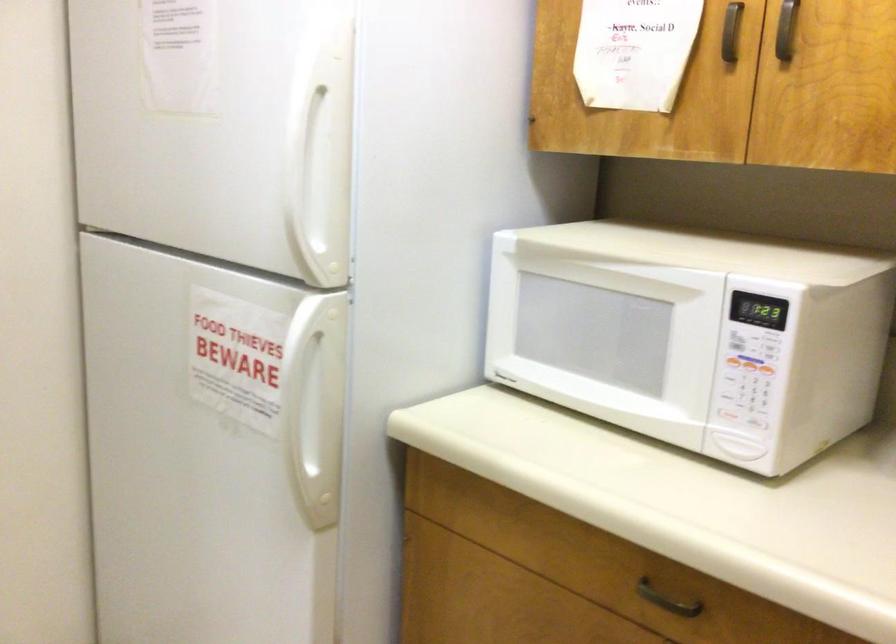
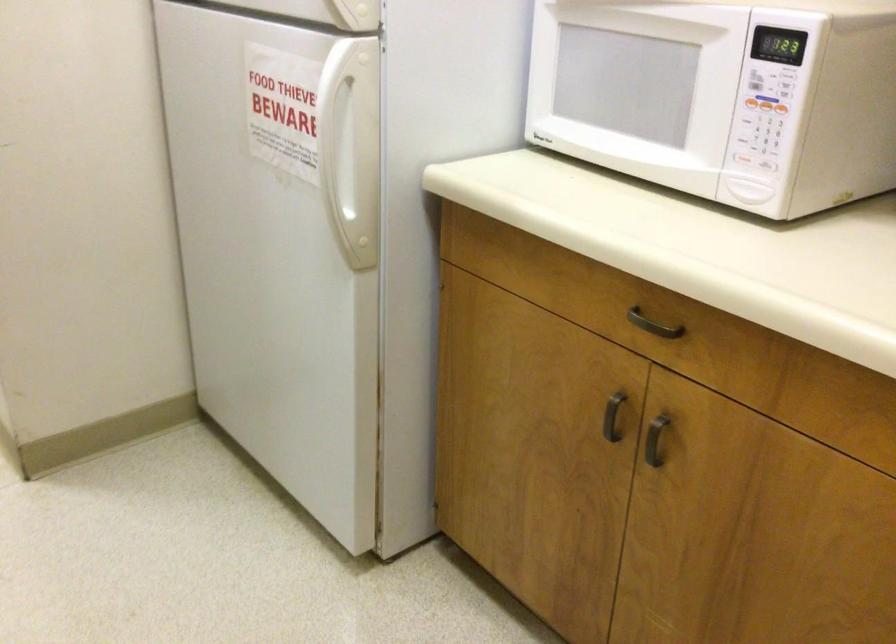
Where in the second image is the point corresponding to point 753,365 from the first image?

(765, 104)